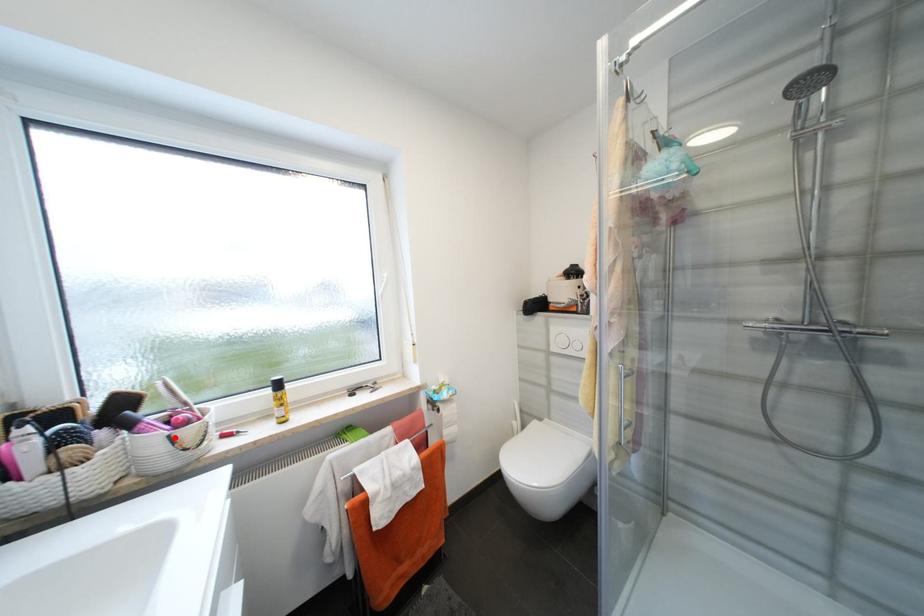
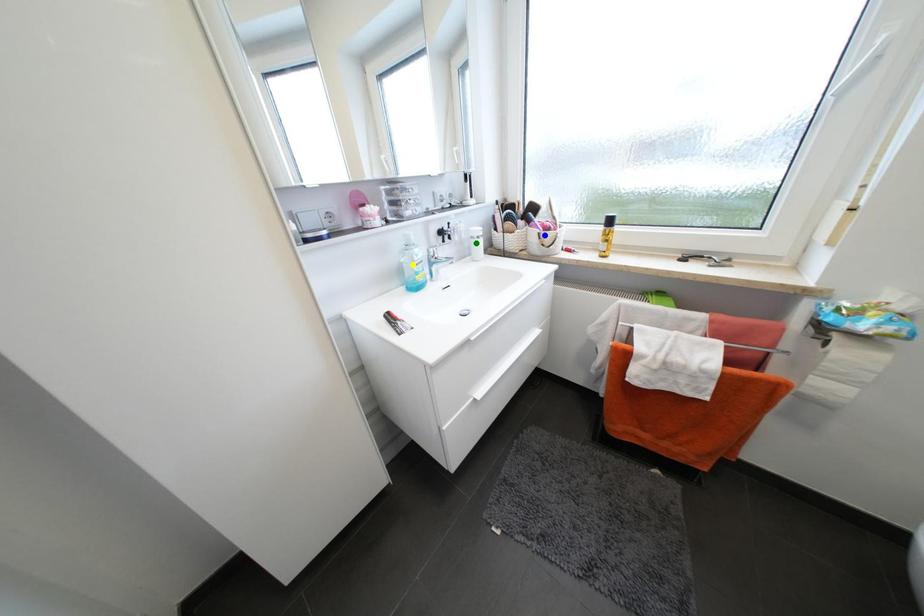
Question: I am providing you with two images of the same scene from different viewpoints. A red point is marked on the first image. You are given multiple points on the second image. In image 2, which mark is for the same physical point as the one in image 1?

Choices:
 (A) green point
 (B) yellow point
 (C) blue point

Answer: (C)